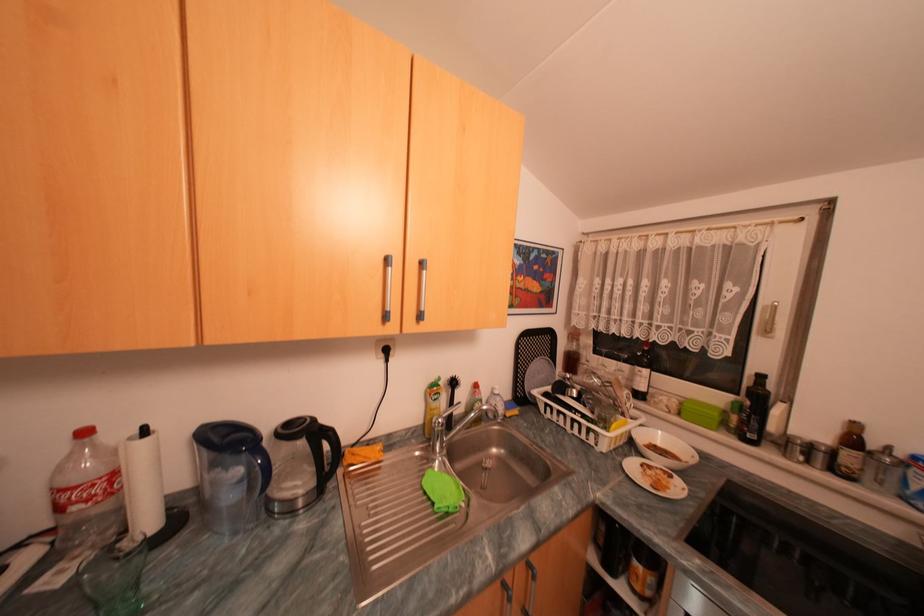
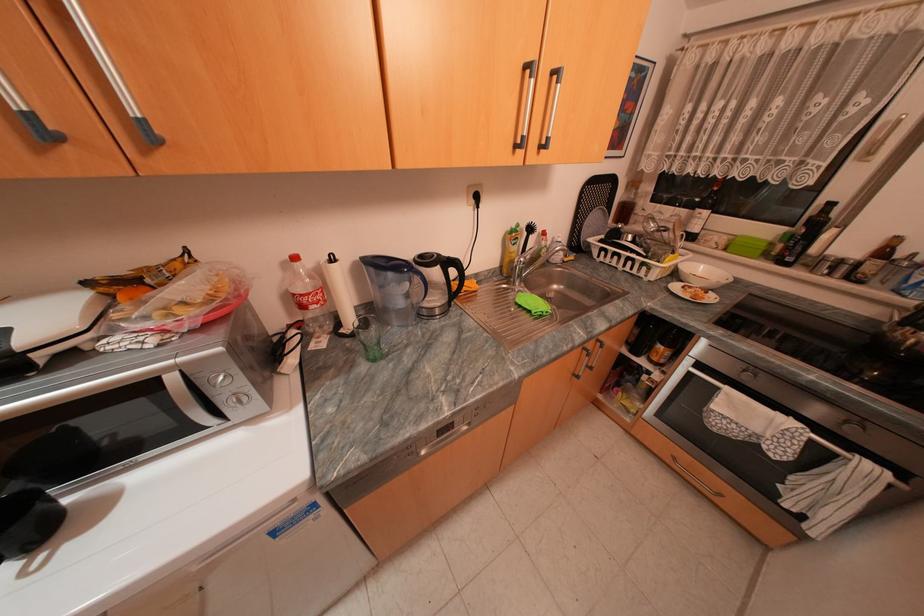
Where in the second image is the point corresponding to (636,366) from the first image?

(694, 209)